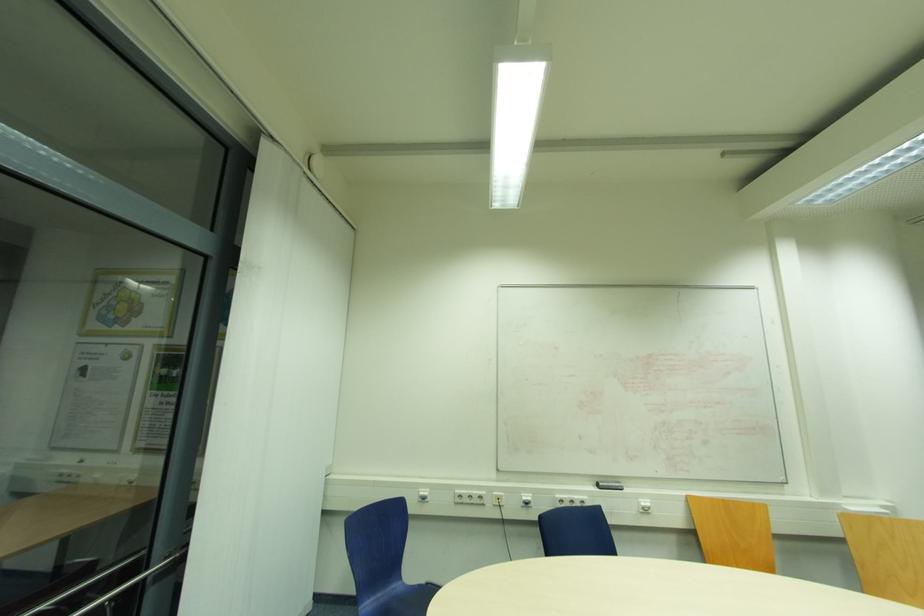
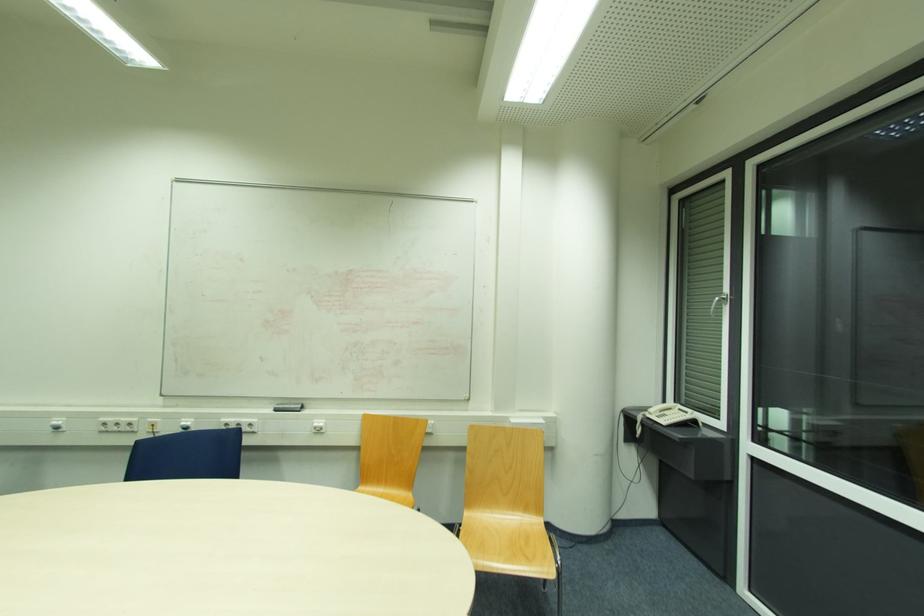
Question: The images are taken continuously from a first-person perspective. In which direction are you moving?

Choices:
 (A) Left
 (B) Right
 (C) Forward
 (D) Backward

Answer: (B)